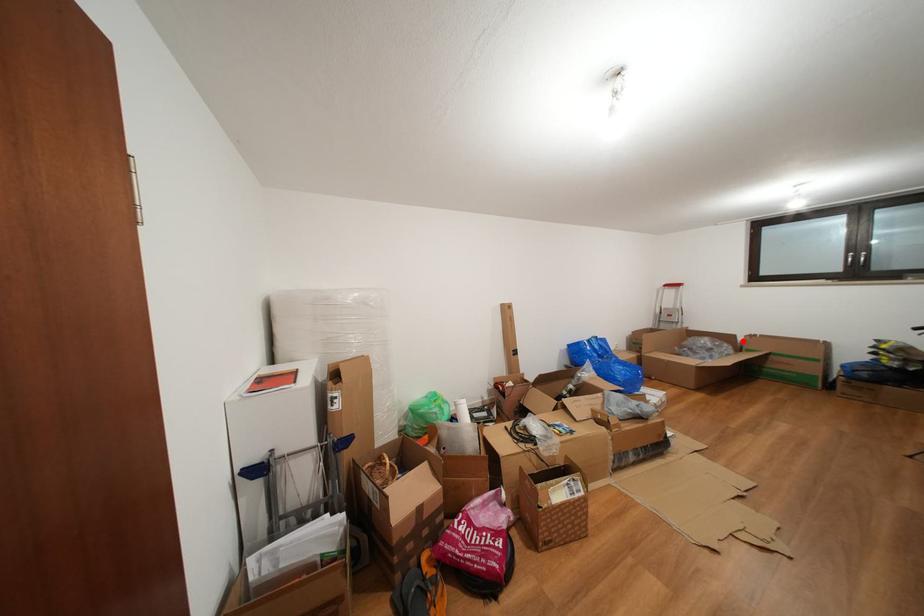
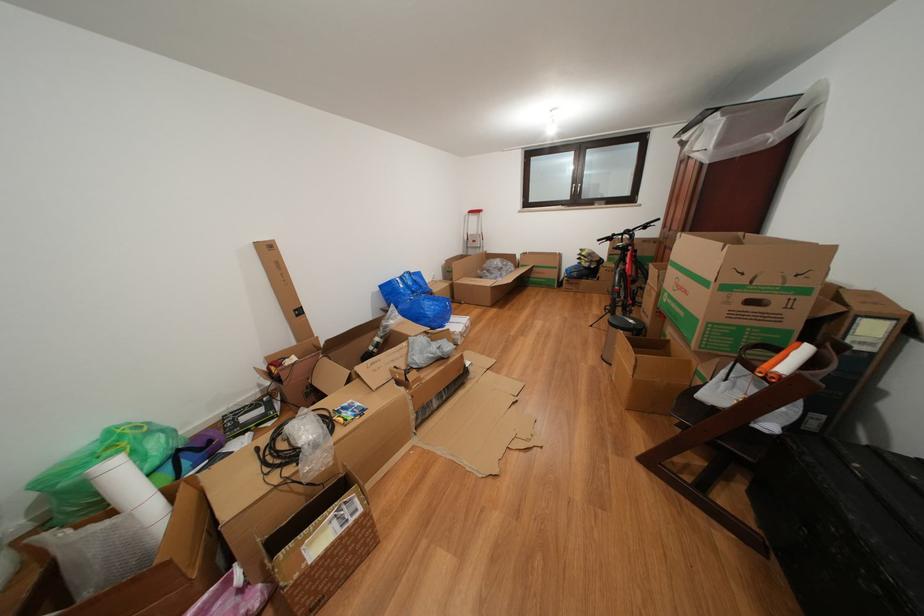
The point at the highlighted location is marked in the first image. Where is the corresponding point in the second image?

(523, 261)